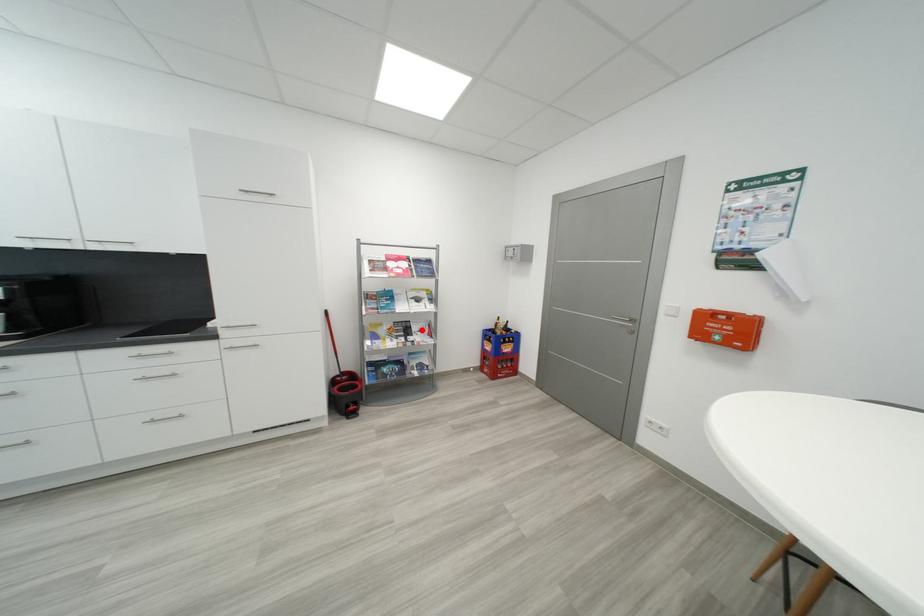
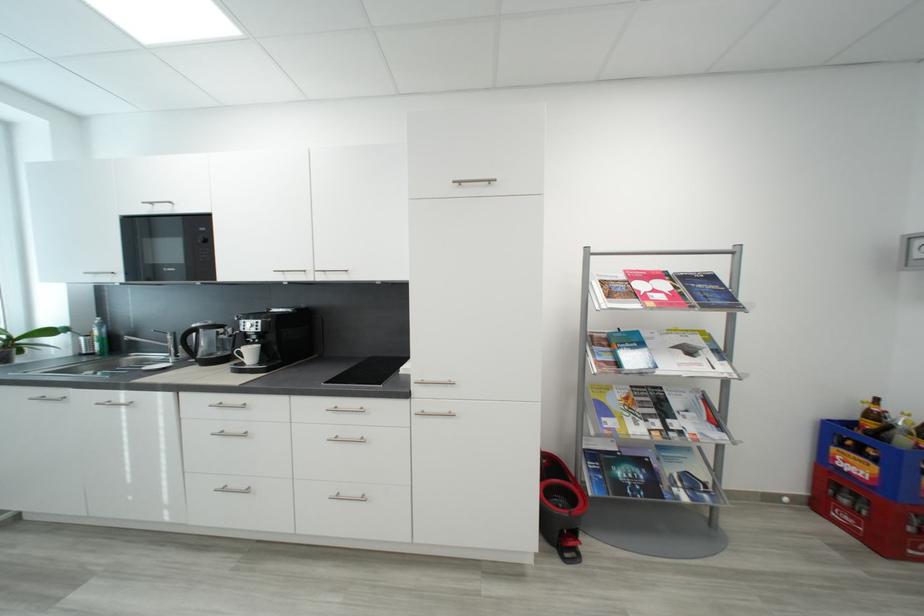
Locate, in the second image, the point that corresponds to the highlighted location in the first image.

(684, 406)